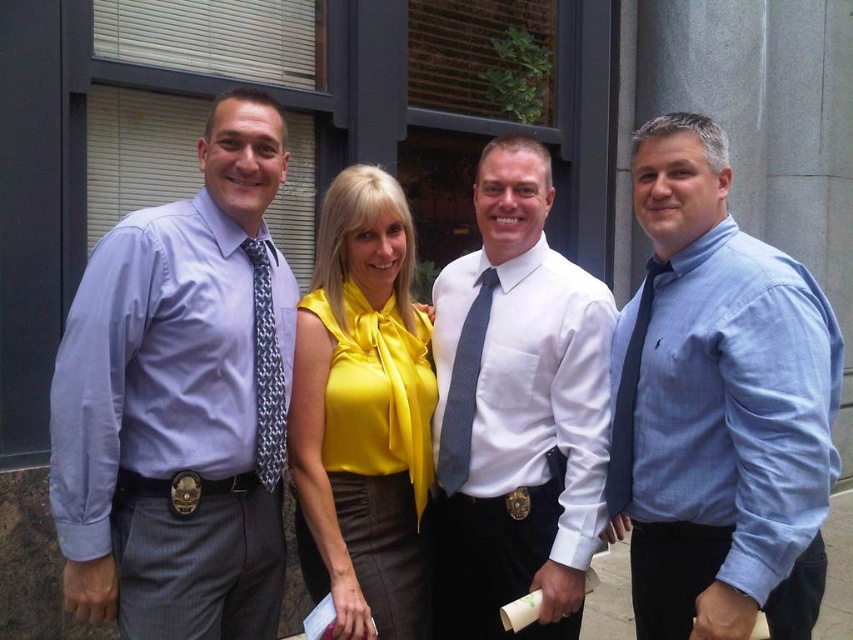
Question: Where is matte purple shirt at left located in relation to dark gray textured tie at center in the image?

Choices:
 (A) above
 (B) below

Answer: (A)

Question: Which of these objects is positioned farthest from the dark gray textured tie at center?

Choices:
 (A) gray textured tie at left
 (B) blue cotton shirt at right
 (C) white smooth shirt at center

Answer: (B)

Question: Can you confirm if white smooth shirt at center is thinner than yellow satin blouse at center?

Choices:
 (A) yes
 (B) no

Answer: (B)

Question: Which object is farther from the camera taking this photo?

Choices:
 (A) black silk tie at right
 (B) blue cotton shirt at right
 (C) yellow satin blouse at center

Answer: (A)

Question: Is white smooth shirt at center closer to camera compared to gray textured tie at left?

Choices:
 (A) no
 (B) yes

Answer: (B)

Question: Estimate the real-world distances between objects in this image. Which object is closer to the white smooth shirt at center?

Choices:
 (A) yellow satin blouse at center
 (B) dark gray textured tie at center
 (C) matte purple shirt at left

Answer: (B)